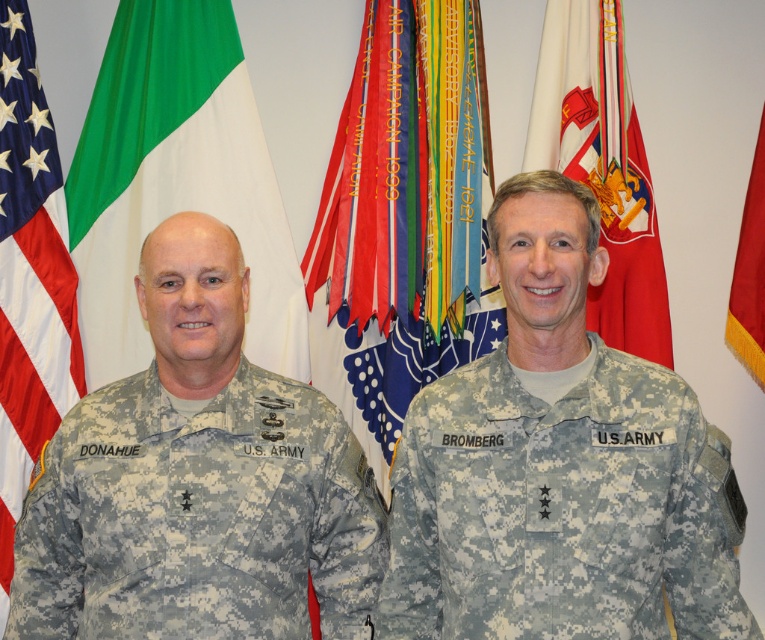
Between multicolored ribbons at center and american flag at left, which one has less height?

multicolored ribbons at center

You are a GUI agent. You are given a task and a screenshot of the screen. Output one action in this format:
    pyautogui.click(x=<x>, y=<y>)
    Task: Click on the multicolored ribbons at center
    
    Given the screenshot: What is the action you would take?
    click(x=396, y=224)

Find the location of a particular element. multicolored ribbons at center is located at coordinates (396, 224).

Where is `multicolored ribbons at center`? multicolored ribbons at center is located at coordinates (396, 224).

Between green fabric flag at left and red fabric flag at center, which one appears on the right side from the viewer's perspective?

Positioned to the right is red fabric flag at center.

Is green fabric flag at left closer to the viewer compared to red fabric flag at center?

Yes, green fabric flag at left is closer to the viewer.

Which is behind, point (246, 112) or point (588, 67)?

Point (588, 67)

At what (x,y) coordinates should I click in order to perform the action: click on green fabric flag at left. Please return your answer as a coordinate pair (x, y). Looking at the image, I should click on (176, 180).

Is camouflage fabric uniform at left behind multicolored ribbons at center?

That is False.

Based on the photo, can you confirm if camouflage fabric uniform at left is wider than multicolored ribbons at center?

Yes.

Find the location of a particular element. camouflage fabric uniform at left is located at coordinates (197, 516).